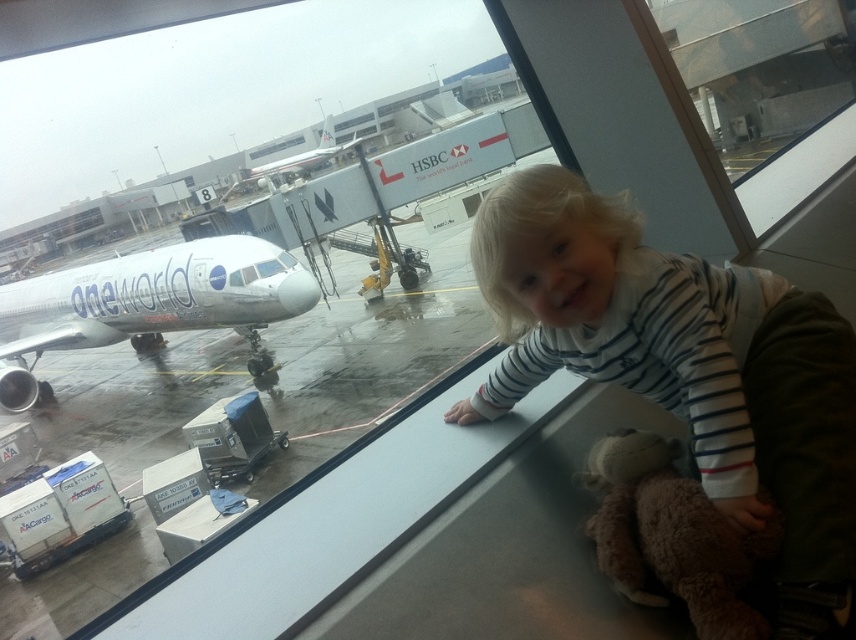
Question: Which object is closer to the camera taking this photo?

Choices:
 (A) white glossy airplane at left
 (B) brown plush teddy bear at lower right

Answer: (B)

Question: Can you confirm if brown plush teddy bear at lower right is positioned to the right of silver metallic airplane at center?

Choices:
 (A) yes
 (B) no

Answer: (A)

Question: Does brown plush teddy bear at lower right appear over transparent glass window at center?

Choices:
 (A) no
 (B) yes

Answer: (A)

Question: Is brown plush teddy bear at lower right smaller than transparent glass window at center?

Choices:
 (A) yes
 (B) no

Answer: (A)

Question: Which point is closer to the camera?

Choices:
 (A) white glossy airplane at left
 (B) silver metallic airplane at center
 (C) white striped shirt at upper right
 (D) transparent glass window at center

Answer: (C)

Question: Which object is closer to the camera taking this photo?

Choices:
 (A) white striped shirt at upper right
 (B) white glossy airplane at left
 (C) silver metallic airplane at center
 (D) brown plush teddy bear at lower right

Answer: (A)